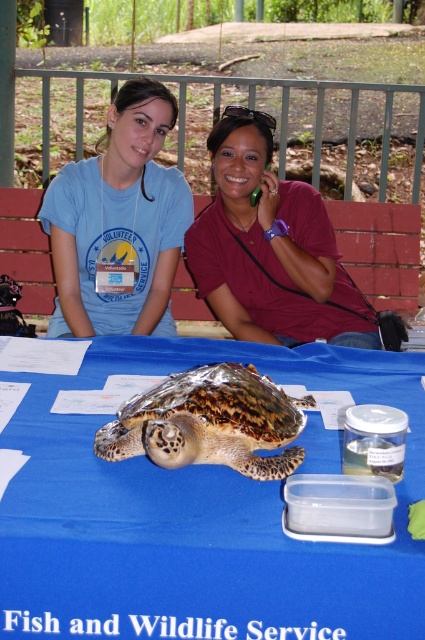
Who is more distant from viewer, [241,124] or [295,445]?

Positioned behind is point [241,124].

Measure the distance between matte maroon shirt at center and camera.

A distance of 6.19 feet exists between matte maroon shirt at center and camera.

Where is `matte maroon shirt at center`? This screenshot has width=425, height=640. matte maroon shirt at center is located at coordinates (269, 250).

Who is higher up, matte blue t-shirt at upper left or matte maroon shirt at center?

Positioned higher is matte blue t-shirt at upper left.

Which is more to the left, matte blue t-shirt at upper left or matte maroon shirt at center?

matte blue t-shirt at upper left is more to the left.

Who is more distant from viewer, (184, 225) or (353, 342)?

The point (184, 225) is behind.

Locate an element on the screen. The image size is (425, 640). matte blue t-shirt at upper left is located at coordinates (119, 224).

Who is more distant from viewer, (404, 600) or (257, 273)?

Positioned behind is point (257, 273).

This screenshot has height=640, width=425. Identify the location of blue fabric table at center. (195, 518).